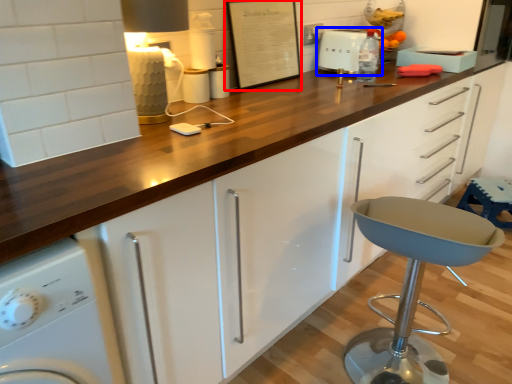
Question: Which object appears closest to the camera in this image, bulletin board (highlighted by a red box) or toaster (highlighted by a blue box)?

Choices:
 (A) bulletin board
 (B) toaster

Answer: (A)